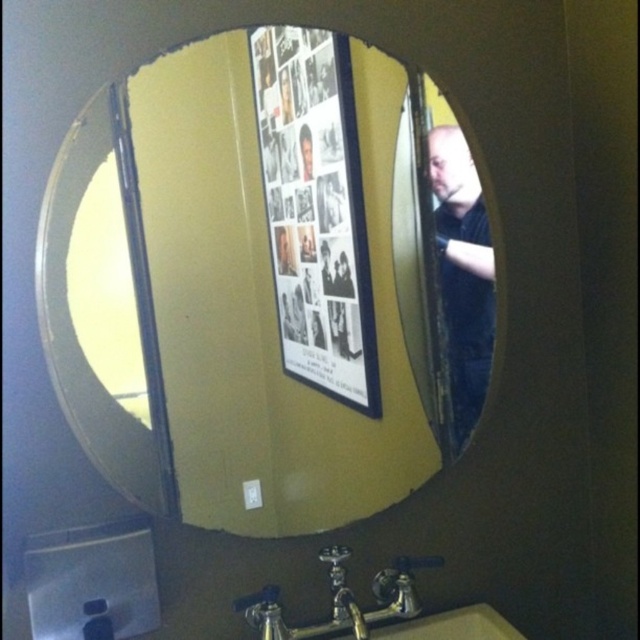
Is point (282, 298) positioned before point (461, 381)?

Yes, point (282, 298) is closer to viewer.

This screenshot has height=640, width=640. What do you see at coordinates (316, 211) in the screenshot? I see `black matte poster at center` at bounding box center [316, 211].

The width and height of the screenshot is (640, 640). I want to click on black matte poster at center, so click(316, 211).

From the picture: Does matte glass mirror at center appear over black matte poster at center?

Actually, matte glass mirror at center is below black matte poster at center.

Is point (376, 216) positioned behind point (348, 317)?

No.

You are a GUI agent. You are given a task and a screenshot of the screen. Output one action in this format:
    pyautogui.click(x=<x>, y=<y>)
    Task: Click on the matte glass mirror at center
    
    Given the screenshot: What is the action you would take?
    (x=276, y=285)

Can you confirm if matte glass mirror at center is taller than dark blue shirt at right?

Yes, matte glass mirror at center is taller than dark blue shirt at right.

Between point (312, 154) and point (461, 252), which one is positioned behind?

Point (461, 252)

I want to click on matte glass mirror at center, so click(x=276, y=285).